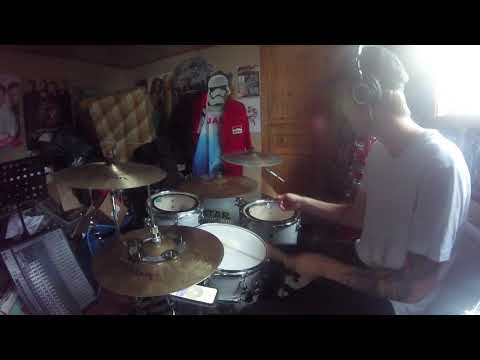
The width and height of the screenshot is (480, 360). In order to click on cabinet in this screenshot , I will do `click(295, 87)`.